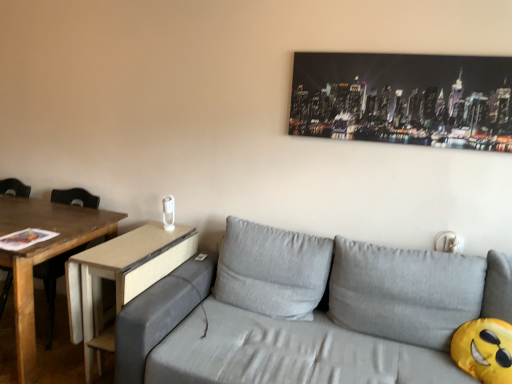
Question: From the image's perspective, is wooden chair at left located above light brown wood side table at center-left?

Choices:
 (A) yes
 (B) no

Answer: (A)

Question: Is wooden chair at left further to the viewer compared to light brown wood side table at center-left?

Choices:
 (A) yes
 (B) no

Answer: (A)

Question: Is wooden chair at left bigger than light brown wood side table at center-left?

Choices:
 (A) yes
 (B) no

Answer: (A)

Question: Can you confirm if wooden chair at left is positioned to the right of light brown wood side table at center-left?

Choices:
 (A) no
 (B) yes

Answer: (A)

Question: From the image's perspective, is wooden chair at left located beneath light brown wood side table at center-left?

Choices:
 (A) no
 (B) yes

Answer: (A)

Question: Can you confirm if wooden chair at left is smaller than light brown wood side table at center-left?

Choices:
 (A) yes
 (B) no

Answer: (B)

Question: Does metallic cityscape print at upper right touch light brown wood side table at center-left?

Choices:
 (A) no
 (B) yes

Answer: (A)

Question: Does metallic cityscape print at upper right appear on the right side of light brown wood side table at center-left?

Choices:
 (A) yes
 (B) no

Answer: (A)

Question: From a real-world perspective, is metallic cityscape print at upper right on top of light brown wood side table at center-left?

Choices:
 (A) yes
 (B) no

Answer: (A)

Question: Is metallic cityscape print at upper right shorter than light brown wood side table at center-left?

Choices:
 (A) no
 (B) yes

Answer: (B)

Question: Is metallic cityscape print at upper right thinner than light brown wood side table at center-left?

Choices:
 (A) yes
 (B) no

Answer: (A)

Question: Is metallic cityscape print at upper right positioned in front of light brown wood side table at center-left?

Choices:
 (A) no
 (B) yes

Answer: (A)

Question: Is light brown wood side table at center-left at the back of gray fabric couch at center?

Choices:
 (A) yes
 (B) no

Answer: (B)